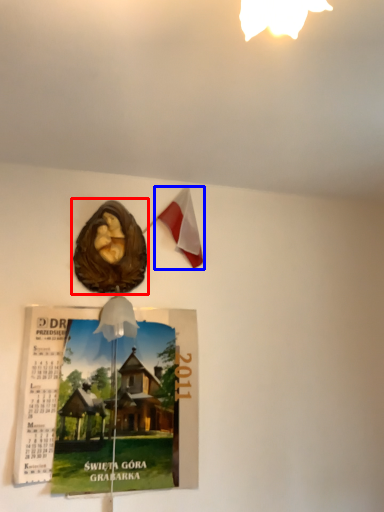
Question: Which object appears closest to the camera in this image, flyer (highlighted by a red box) or flag (highlighted by a blue box)?

Choices:
 (A) flyer
 (B) flag

Answer: (A)